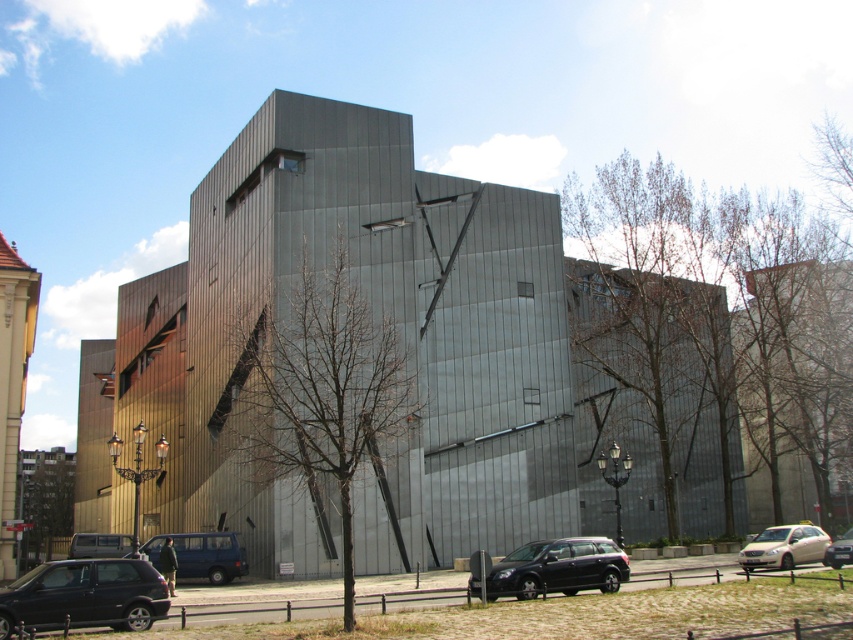
Question: Is bare branches at center positioned at the back of white glossy sedan at lower right?

Choices:
 (A) yes
 (B) no

Answer: (B)

Question: Estimate the real-world distances between objects in this image. Which object is farther from the matte black car at lower left?

Choices:
 (A) shiny black suv at center
 (B) white glossy sedan at lower right
 (C) bare branches at center

Answer: (B)

Question: Based on their relative distances, which object is farther from the shiny black suv at center?

Choices:
 (A) green leafy tree at lower left
 (B) matte black car at lower left
 (C) blue metallic van at lower left
 (D) matte gray van at lower left

Answer: (A)

Question: Does green leafy tree at center have a larger size compared to shiny black suv at center?

Choices:
 (A) yes
 (B) no

Answer: (A)

Question: Estimate the real-world distances between objects in this image. Which object is closer to the green leafy tree at lower left?

Choices:
 (A) green leafy tree at center
 (B) matte gray van at lower left

Answer: (B)

Question: From the image, what is the correct spatial relationship of green leafy tree at center in relation to matte black car at lower left?

Choices:
 (A) below
 (B) above

Answer: (B)